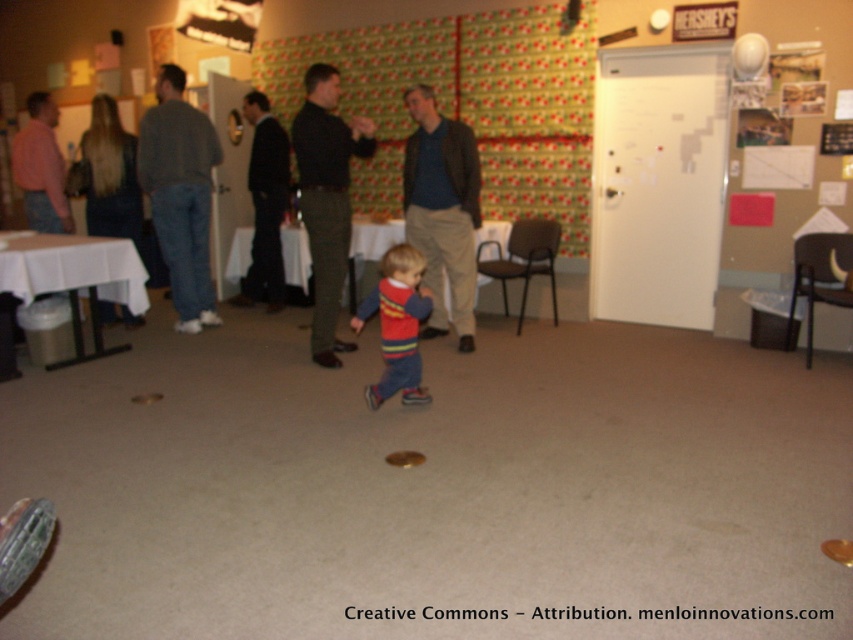
You are standing in the room and want to pick up an object from the floor. There are two points marked on the floor where objects are located. The first point is at coordinates point (421, 403), and the second is at point (54, 113). Which of these two points is closer to you?

Point (421, 403) is closer to the camera than point (54, 113), so the first point is closer to you.

You are organizing a game of musical chairs in the room. The chairs are arranged in a circle with a diameter of 3 meters. The game requires participants to stand within the circle. Can both the person wearing the matte red sweater at center and the one in the matte pink shirt at left participate in the game without needing to move their positions?

The distance between the matte red sweater at center and the matte pink shirt at left is 2.93 meters. Since the diameter of the circle is 3 meters, the maximum distance between any two points inside the circle is 3 meters. Therefore, the two participants can stay in their current positions and participate in the game as their separation is within the circle.

You are a photographer trying to capture a photo of the gray sweater at left and the dark green textured pants at center. To ensure both are in frame, should you adjust your camera to focus more to the left or the right?

The gray sweater at left is positioned on the left side of dark green textured pants at center, so you should focus more to the left to include both in the frame.